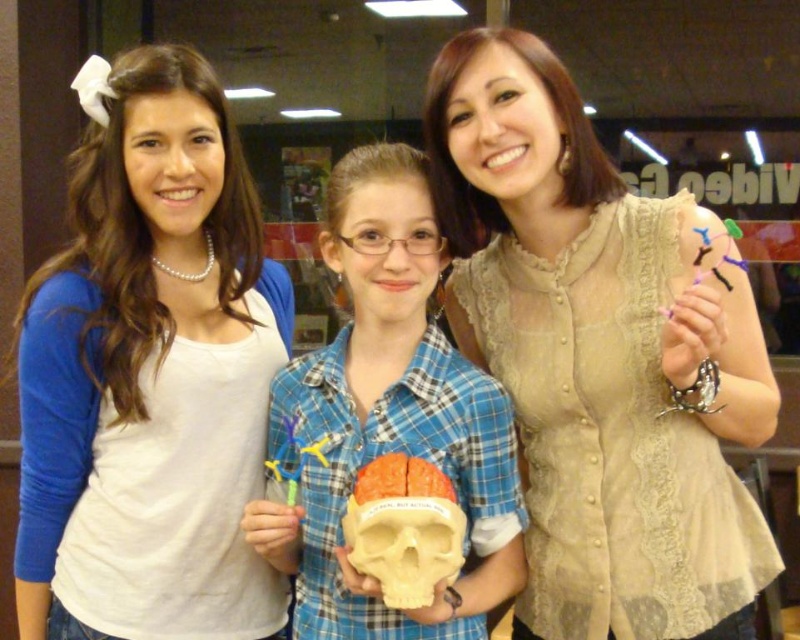
You are a photographer standing in front of the beige lace blouse at center and the orange matte skull at center. You want to take a photo of both objects in the same frame. Given that your camera has a focal length of 50mm and a sensor size of 24mm x 36mm, what is the minimum distance you need to stand from the objects to ensure both fit within the frame?

The minimum distance required is calculated using the formula distance > focal length multiplied by object separation divided by sensor width. Here, the beige lace blouse at center and orange matte skull at center are 17.97 inches apart. Plugging in the values, distance > 50mm x 17.97 inches divided by 36mm. Converting inches to mm, 17.97 inches equals approximately 456.3 mm. Thus, distance > 50 x 456.3 divided by 36, which equals approximately 633.75 mm or about 24.95 inches. Therefore, you need to stand a

You are standing in a classroom and see the point at coordinates (x=732, y=401). If you want to reach it without moving your feet, can you do so with your arm? Assume your arm can reach up to 4.0 feet.

The point at coordinates (x=732, y=401) is 4.08 feet away from the viewer. Since your arm can only reach up to 4.0 feet, you cannot reach it without moving your feet.

You are a photographer setting up a tripod to take a group photo of the beige lace blouse at center and the matte plastic skull at center. The minimum distance your camera can focus clearly on two objects is 9 inches. Will both objects be in focus if you place the tripod exactly between them?

The beige lace blouse at center is 9.11 inches from the matte plastic skull at center. Since the minimum focus distance is 9 inches, the 0.11 inch difference means the camera might not be able to keep both objects in focus simultaneously. You may need to adjust the tripod position or use a different lens.